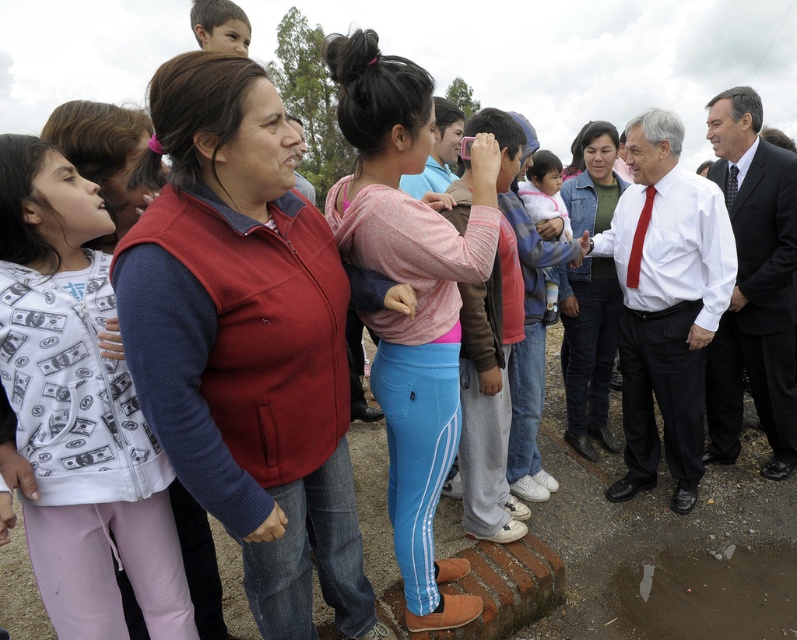
Looking at this image, does pink fabric shirt at center appear on the right side of matte green sweater at center?

No, pink fabric shirt at center is not to the right of matte green sweater at center.

Is point (375, 326) farther from viewer compared to point (587, 291)?

That is False.

You are a GUI agent. You are given a task and a screenshot of the screen. Output one action in this format:
    pyautogui.click(x=<x>, y=<y>)
    Task: Click on the pink fabric shirt at center
    Image resolution: width=797 pixels, height=640 pixels.
    Given the screenshot: What is the action you would take?
    coord(415,292)

Is matte red vest at center taller than red silk tie at center-right?

Indeed, matte red vest at center has a greater height compared to red silk tie at center-right.

Image resolution: width=797 pixels, height=640 pixels. What do you see at coordinates (248, 340) in the screenshot?
I see `matte red vest at center` at bounding box center [248, 340].

This screenshot has width=797, height=640. Find the location of `matte red vest at center`. matte red vest at center is located at coordinates point(248,340).

Does matte fleece vest at center have a larger size compared to matte white shirt at center?

No.

Does matte fleece vest at center appear on the right side of matte white shirt at center?

No, matte fleece vest at center is not to the right of matte white shirt at center.

Between point (38, 406) and point (693, 340), which one is positioned behind?

The point (693, 340) is more distant.

Locate an element on the screen. This screenshot has height=640, width=797. matte fleece vest at center is located at coordinates (77, 412).